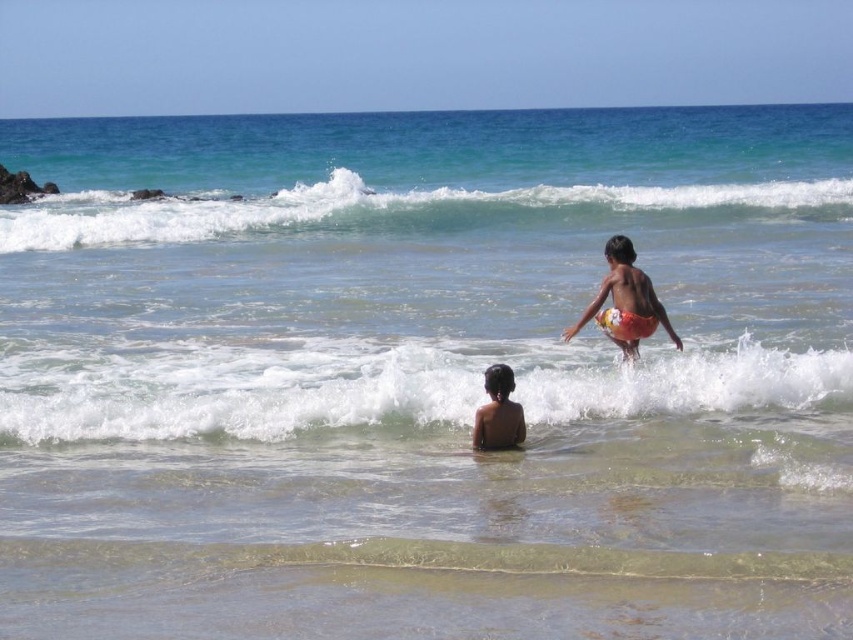
Question: Can you confirm if white frothy wave at center is thinner than greenish-blue foam at upper center?

Choices:
 (A) yes
 (B) no

Answer: (A)

Question: In this image, where is white frothy wave at center located relative to yellow patterned shorts at center?

Choices:
 (A) left
 (B) right

Answer: (A)

Question: Is white frothy wave at center smaller than greenish-blue foam at upper center?

Choices:
 (A) yes
 (B) no

Answer: (A)

Question: Which is farther from the yellow patterned shorts at center?

Choices:
 (A) white frothy wave at center
 (B) greenish-blue foam at upper center

Answer: (B)

Question: Among these objects, which one is nearest to the camera?

Choices:
 (A) yellow patterned shorts at center
 (B) white frothy wave at center
 (C) brown skin at lower center
 (D) greenish-blue foam at upper center

Answer: (C)

Question: Estimate the real-world distances between objects in this image. Which object is farther from the greenish-blue foam at upper center?

Choices:
 (A) yellow patterned shorts at center
 (B) brown skin at lower center
 (C) white frothy wave at center

Answer: (A)